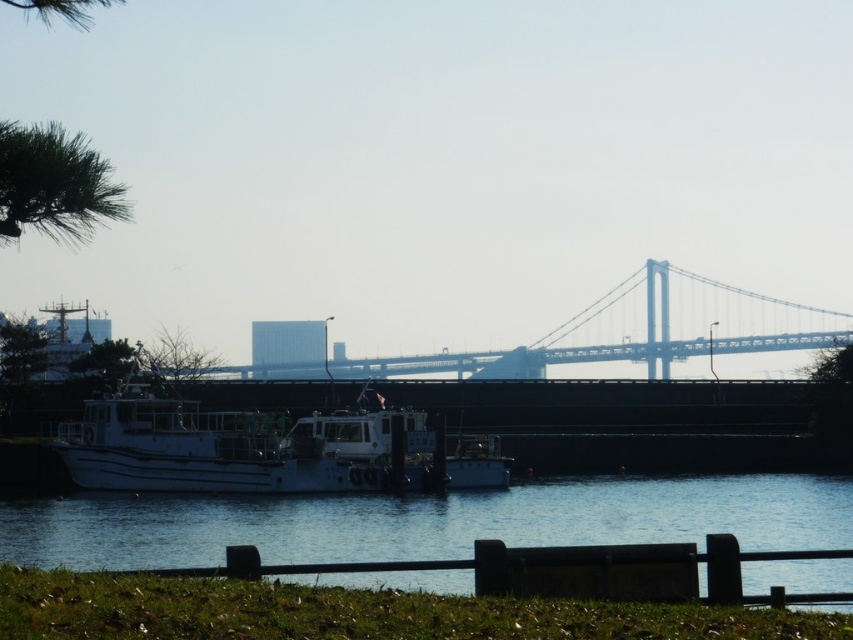
Looking at this image, is white matte boat at lower left wider than metallic gray bridge at center?

In fact, white matte boat at lower left might be narrower than metallic gray bridge at center.

Measure the distance between point (x=128, y=458) and camera.

They are 70.71 meters apart.

At what (x,y) coordinates should I click in order to perform the action: click on white matte boat at lower left. Please return your answer as a coordinate pair (x, y). This screenshot has height=640, width=853. Looking at the image, I should click on (265, 449).

Who is positioned more to the left, blue water at lower center or white matte boat at lower left?

white matte boat at lower left

The image size is (853, 640). What are the coordinates of `blue water at lower center` in the screenshot? It's located at point(428,522).

Can you confirm if blue water at lower center is thinner than metallic gray bridge at center?

Correct, blue water at lower center's width is less than metallic gray bridge at center's.

Is blue water at lower center above metallic gray bridge at center?

Actually, blue water at lower center is below metallic gray bridge at center.

Locate an element on the screen. This screenshot has width=853, height=640. blue water at lower center is located at coordinates (428, 522).